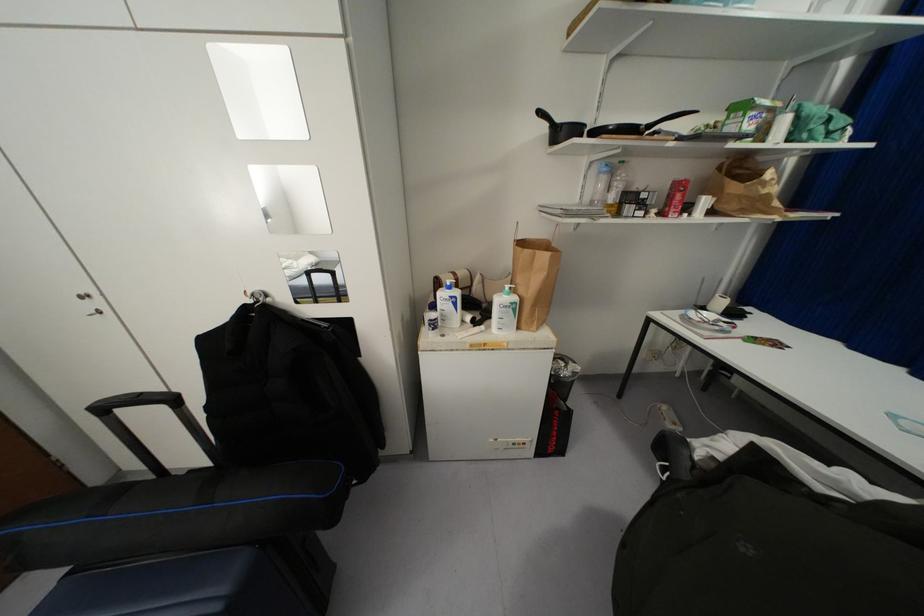
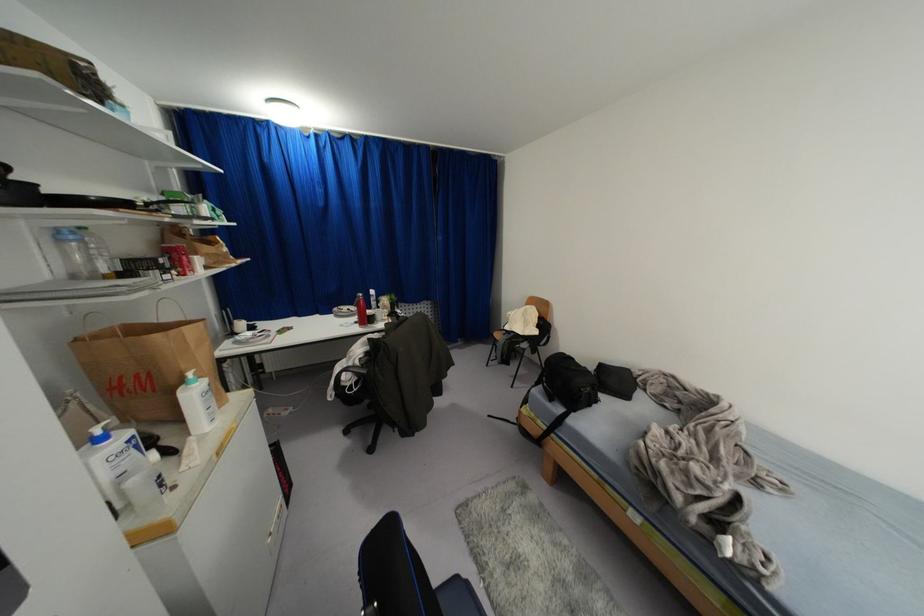
The point at (701, 307) is marked in the first image. Where is the corresponding point in the second image?

(234, 333)